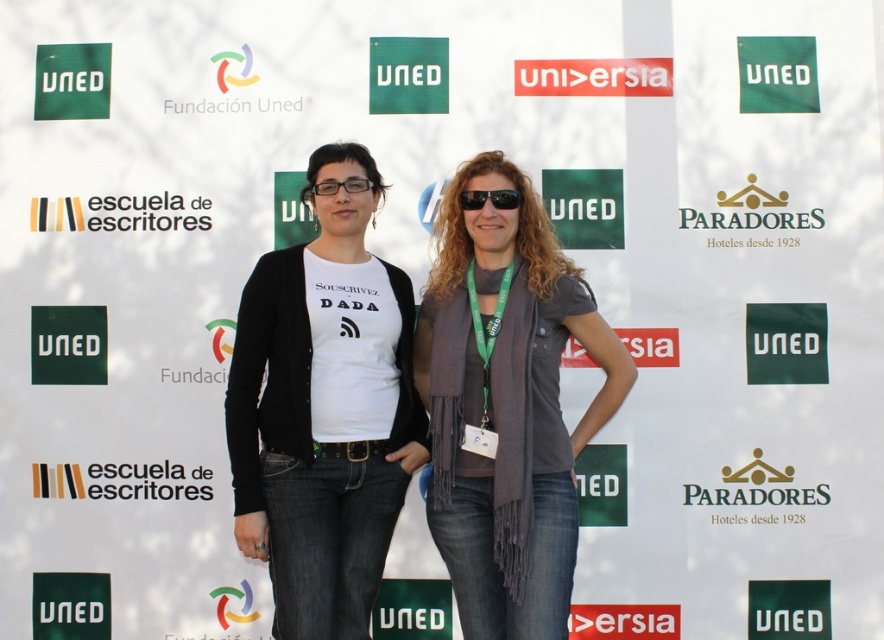
Can you confirm if black reflective sunglasses at center is bigger than black plastic glasses at center?

Actually, black reflective sunglasses at center might be smaller than black plastic glasses at center.

Measure the distance between black reflective sunglasses at center and camera.

A distance of 22.77 feet exists between black reflective sunglasses at center and camera.

Does point (465, 209) come behind point (329, 177)?

No, it is not.

Identify the location of black reflective sunglasses at center. (489, 198).

Looking at this image, which is below, black matte cardigan at center or black plastic glasses at center?

black matte cardigan at center is lower down.

Who is more distant from viewer, (314, 154) or (317, 182)?

The point (314, 154) is behind.

Is point (233, 420) farther from camera compared to point (332, 179)?

No, (233, 420) is in front of (332, 179).

You are a GUI agent. You are given a task and a screenshot of the screen. Output one action in this format:
    pyautogui.click(x=<x>, y=<y>)
    Task: Click on the black matte cardigan at center
    The height and width of the screenshot is (640, 884).
    Given the screenshot: What is the action you would take?
    pyautogui.click(x=324, y=410)

Does gray scarf at center have a larger size compared to black reflective sunglasses at center?

Correct, gray scarf at center is larger in size than black reflective sunglasses at center.

What do you see at coordinates (507, 404) in the screenshot? I see `gray scarf at center` at bounding box center [507, 404].

At what (x,y) coordinates should I click in order to perform the action: click on gray scarf at center. Please return your answer as a coordinate pair (x, y). The image size is (884, 640). Looking at the image, I should click on pyautogui.click(x=507, y=404).